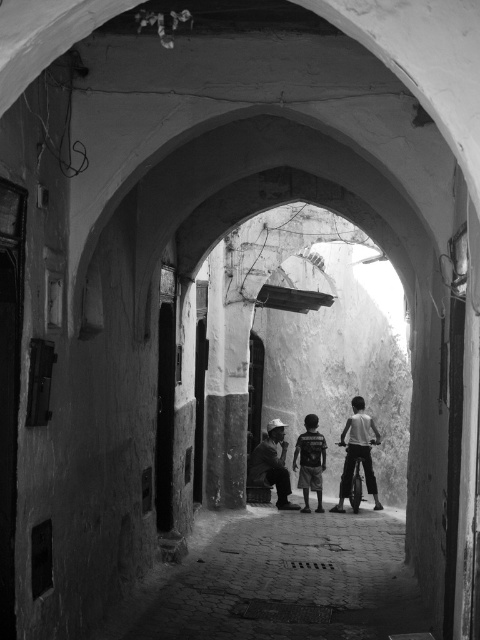
Question: Estimate the real-world distances between objects in this image. Which object is closer to the striped t-shirt at center?

Choices:
 (A) light brown wooden bicycle at center
 (B) smooth fabric shirt at center

Answer: (B)

Question: In this image, where is light brown wooden bicycle at center located relative to smooth fabric shirt at center?

Choices:
 (A) left
 (B) right

Answer: (B)

Question: In this image, where is smooth fabric shirt at center located relative to striped t-shirt at center?

Choices:
 (A) right
 (B) left

Answer: (B)

Question: Observing the image, what is the correct spatial positioning of smooth fabric shirt at center in reference to striped t-shirt at center?

Choices:
 (A) above
 (B) below

Answer: (B)

Question: Which point is farther to the camera?

Choices:
 (A) 362,461
 (B) 285,506
 (C) 313,442

Answer: (C)

Question: Which point is closer to the camera taking this photo?

Choices:
 (A) (369, 481)
 (B) (276, 454)
 (C) (324, 452)

Answer: (A)